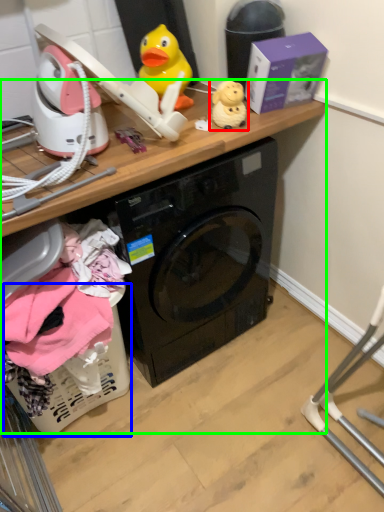
Question: Which object is the closest to the toy (highlighted by a red box)? Choose among these: basket (highlighted by a blue box) or computer desk (highlighted by a green box).

Choices:
 (A) basket
 (B) computer desk

Answer: (B)